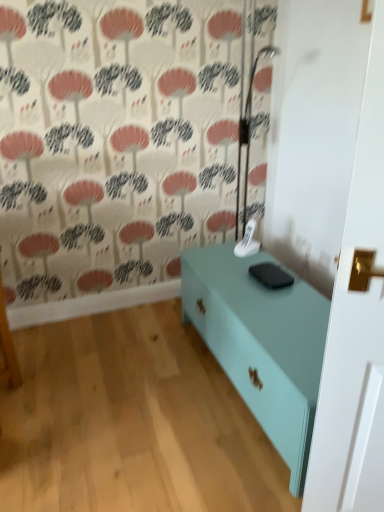
Where is `free space above mint green wood table at center (from a real-world perspective)`? This screenshot has height=512, width=384. free space above mint green wood table at center (from a real-world perspective) is located at coordinates (266, 295).